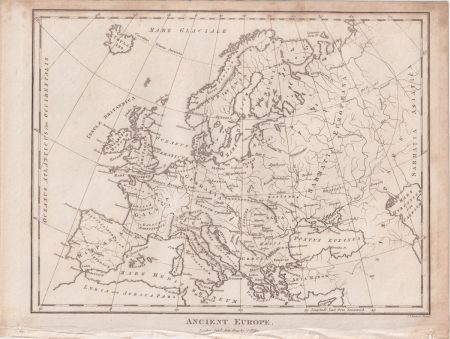
Where is `map on paper/parchment`? This screenshot has height=339, width=450. map on paper/parchment is located at coordinates (225, 156).